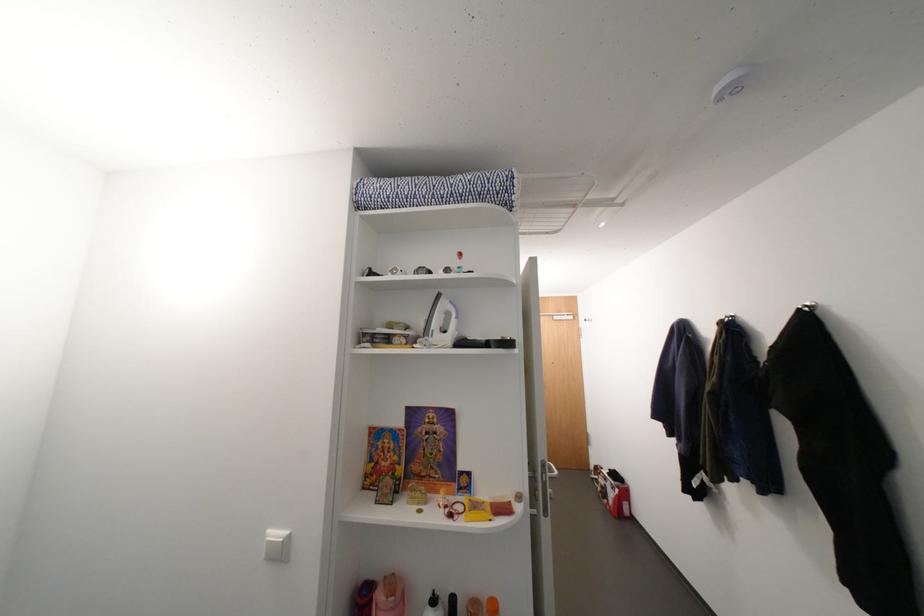
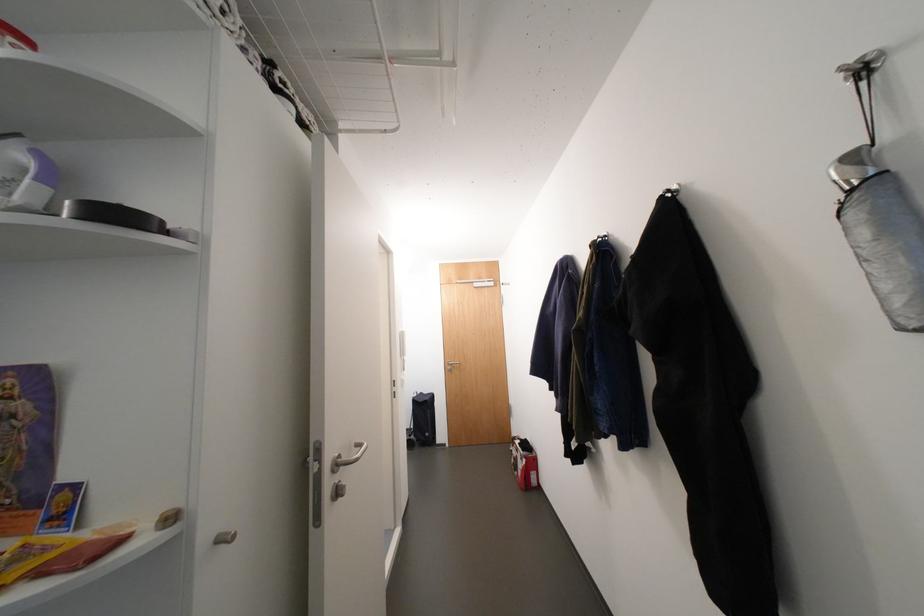
What movement of the cameraman would produce the second image?

The cameraman moved toward right, forward.